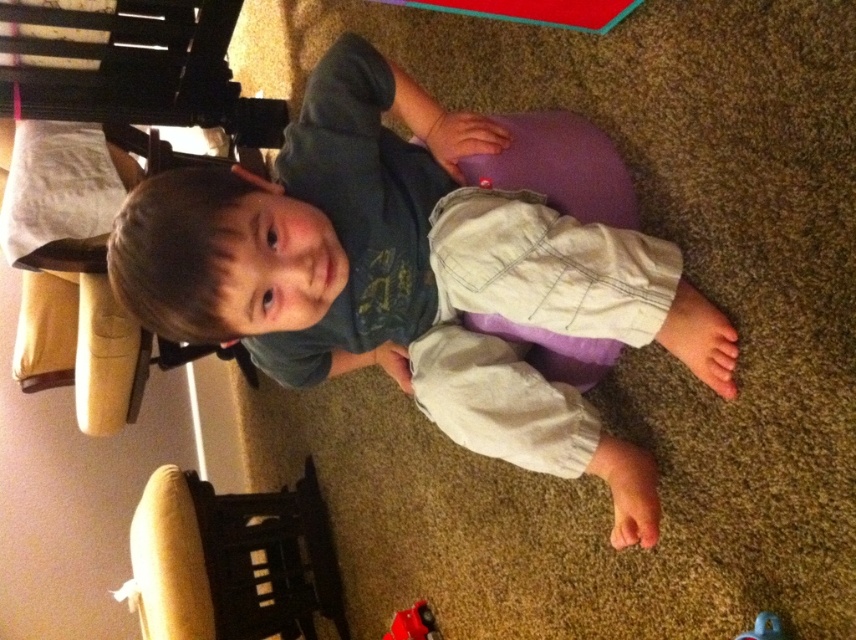
In the scene shown: You are a parent who wants to place a 1.5 meter long toy box in the living room. The toy box must be placed between the velvet beige bean bag chair at left and the camera. Is there enough space to fit the toy box between them?

The velvet beige bean bag chair at left is 1.84 meters away from the camera. Since the toy box is 1.5 meters long, there is enough space to place it between the velvet beige bean bag chair at left and the camera because 1.5 meters is shorter than 1.84 meters.